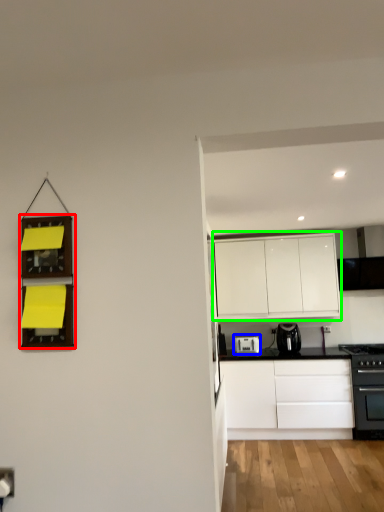
Question: Estimate the real-world distances between objects in this image. Which object is farther from shelf (highlighted by a red box), kitchen appliance (highlighted by a blue box) or cabinetry (highlighted by a green box)?

Choices:
 (A) kitchen appliance
 (B) cabinetry

Answer: (B)